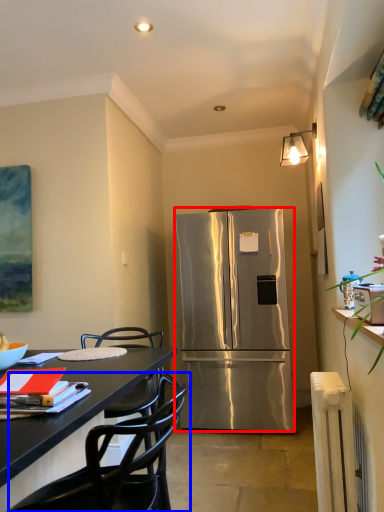
Question: Among these objects, which one is farthest to the camera, refrigerator (highlighted by a red box) or chair (highlighted by a blue box)?

Choices:
 (A) refrigerator
 (B) chair

Answer: (A)